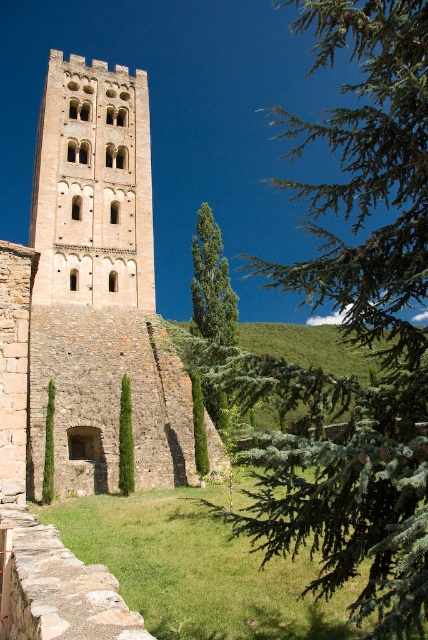
Question: Considering the relative positions of green leafy tree at upper right and light brown stone tower at center in the image provided, where is green leafy tree at upper right located with respect to light brown stone tower at center?

Choices:
 (A) right
 (B) left

Answer: (A)

Question: Which point appears farthest from the camera in this image?

Choices:
 (A) (71, 356)
 (B) (389, 477)
 (C) (88, 228)

Answer: (C)

Question: Is green leafy tree at upper right smaller than green leafy tree at center?

Choices:
 (A) no
 (B) yes

Answer: (A)

Question: From the image, what is the correct spatial relationship of light brown stone tower at center in relation to green leafy tree at center?

Choices:
 (A) right
 (B) left

Answer: (B)

Question: Considering the real-world distances, which object is farthest from the light brown stone tower at center?

Choices:
 (A) green leafy tree at upper right
 (B) green leafy tree at center
 (C) beige stone tower at center

Answer: (A)

Question: Considering the real-world distances, which object is closest to the light brown stone tower at center?

Choices:
 (A) green leafy tree at center
 (B) beige stone tower at center

Answer: (B)